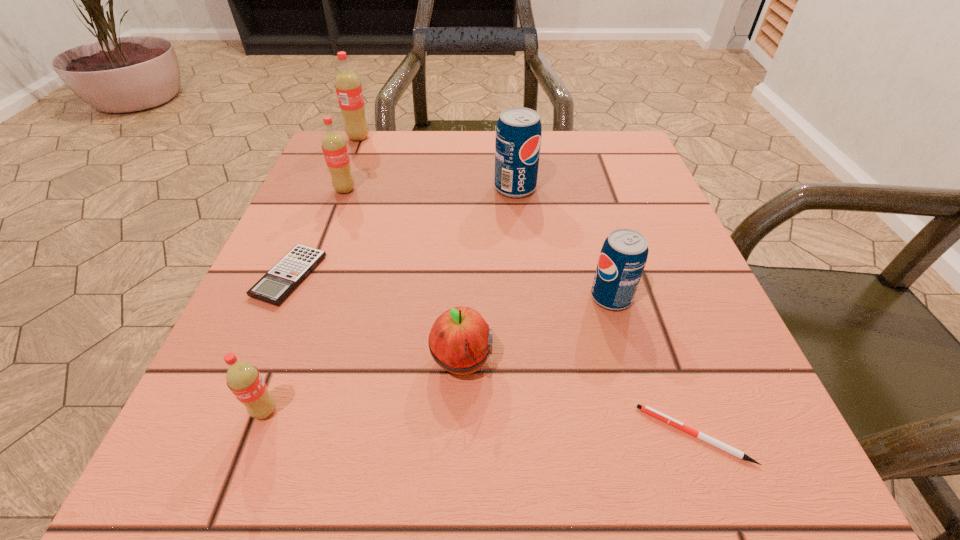
Locate an element on the screen. the fourth object from right to left is located at coordinates (460, 341).

Find the location of a particular element. The width and height of the screenshot is (960, 540). the second shortest object is located at coordinates (279, 282).

Where is `white pen`? This screenshot has height=540, width=960. white pen is located at coordinates (735, 452).

Find the location of a particular element. the shortest object is located at coordinates (735, 452).

Where is `free space located 0.270m on the front of the farthest object`? free space located 0.270m on the front of the farthest object is located at coordinates (329, 212).

Locate an element on the screen. This screenshot has height=540, width=960. vacant area located 0.240m on the front of the left blue pop is located at coordinates (525, 286).

Image resolution: width=960 pixels, height=540 pixels. I want to click on vacant space located 0.240m on the front of the second nearest red soda, so click(x=310, y=281).

Locate an element on the screen. Image resolution: width=960 pixels, height=540 pixels. vacant point located on the front of the rightmost soda is located at coordinates (626, 350).

At what (x,y) coordinates should I click in order to perform the action: click on vacant space situated on the left of the nearest soda. Please return your answer as a coordinate pair (x, y). Looking at the image, I should click on (204, 410).

In order to click on vacant area situated 0.220m on the back of the third nearest object in this screenshot , I will do `click(466, 237)`.